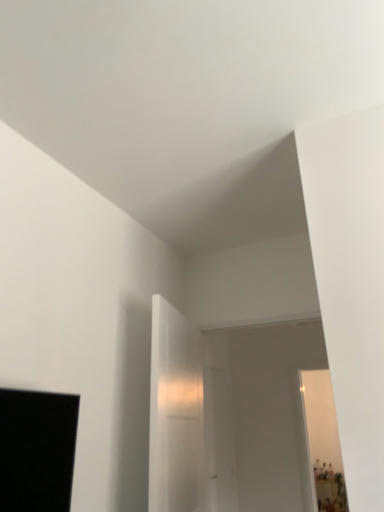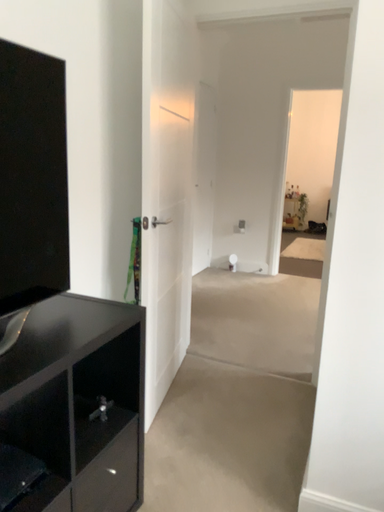
Question: How did the camera likely rotate when shooting the video?

Choices:
 (A) rotated downward
 (B) rotated upward

Answer: (A)